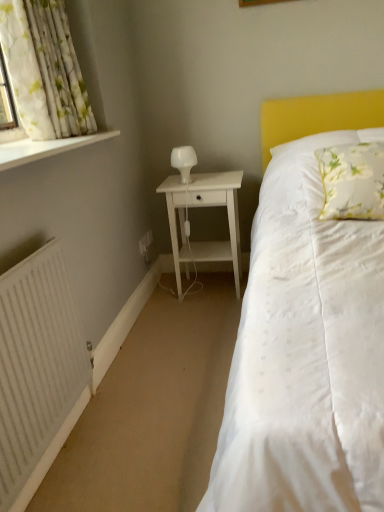
The height and width of the screenshot is (512, 384). What do you see at coordinates (352, 181) in the screenshot?
I see `floral fabric pillow at upper right` at bounding box center [352, 181].

The height and width of the screenshot is (512, 384). Describe the element at coordinates (37, 370) in the screenshot. I see `white matte radiator at lower left` at that location.

Based on the photo, measure the distance between white matte radiator at lower left and camera.

The distance of white matte radiator at lower left from camera is 1.14 meters.

What do you see at coordinates (200, 207) in the screenshot? I see `white wood nightstand at center` at bounding box center [200, 207].

Identify the location of white floral fabric curtain at upper left. (44, 69).

In the scene shown: What is the approximate height of white floral fabric curtain at upper left?

white floral fabric curtain at upper left is 24.23 inches tall.

Where is `white glossy table lamp at center`? white glossy table lamp at center is located at coordinates (184, 161).

How different are the orientations of white floral fabric curtain at upper left and white wood nightstand at center in degrees?

They differ by 87.9 degrees in their facing directions.

Based on their positions, is white floral fabric curtain at upper left located to the left or right of white wood nightstand at center?

From the image, it's evident that white floral fabric curtain at upper left is to the left of white wood nightstand at center.

Are white floral fabric curtain at upper left and white wood nightstand at center located far from each other?

That's not correct — white floral fabric curtain at upper left is a little close to white wood nightstand at center.

Can white wood nightstand at center be found inside white floral fabric curtain at upper left?

No, white wood nightstand at center is not surrounded by white floral fabric curtain at upper left.

Is point (235, 195) closer or farther from the camera than point (64, 143)?

Point (235, 195) is farther from the camera than point (64, 143).

Does white wood nightstand at center have a greater height compared to white painted wood at left?

Indeed, white wood nightstand at center has a greater height compared to white painted wood at left.

From the image's perspective, is white wood nightstand at center above or below white painted wood at left?

Based on their image positions, white wood nightstand at center is located beneath white painted wood at left.

Considering the positions of objects white matte radiator at lower left and white glossy table lamp at center in the image provided, who is more to the right, white matte radiator at lower left or white glossy table lamp at center?

white glossy table lamp at center.

Between point (72, 393) and point (182, 158), which one is positioned in front?

The point (72, 393) is closer.

Do you think white floral fabric curtain at upper left is within floral fabric pillow at upper right, or outside of it?

white floral fabric curtain at upper left lies outside floral fabric pillow at upper right.

Looking at this image, which of these two, white floral fabric curtain at upper left or floral fabric pillow at upper right, is thinner?

With smaller width is white floral fabric curtain at upper left.

Locate an element on the screen. curtain on the left of floral fabric pillow at upper right is located at coordinates (44, 69).

Is white glossy table lamp at center situated inside white painted wood at left or outside?

white glossy table lamp at center is located beyond the bounds of white painted wood at left.

From a real-world perspective, which object rests below the other?

white glossy table lamp at center.

Considering the sizes of objects white glossy table lamp at center and white painted wood at left in the image provided, who is thinner, white glossy table lamp at center or white painted wood at left?

With smaller width is white glossy table lamp at center.

Which of these two, white glossy table lamp at center or white painted wood at left, is bigger?

white painted wood at left.

The width and height of the screenshot is (384, 512). Find the location of `radiator on the left of the floral fabric pillow at upper right`. radiator on the left of the floral fabric pillow at upper right is located at coordinates (37, 370).

Is floral fabric pillow at upper right closer to the viewer compared to white matte radiator at lower left?

No, the depth of floral fabric pillow at upper right is greater than that of white matte radiator at lower left.

Can you tell me how much floral fabric pillow at upper right and white matte radiator at lower left differ in facing direction?

The facing directions of floral fabric pillow at upper right and white matte radiator at lower left are 93.7 degrees apart.

Looking at this image, from a real-world perspective, who is located lower, white wood nightstand at center or white floral fabric curtain at upper left?

white wood nightstand at center.

Based on the photo, in terms of height, does white wood nightstand at center look taller or shorter compared to white floral fabric curtain at upper left?

Clearly, white wood nightstand at center is taller compared to white floral fabric curtain at upper left.

Where is `curtain in front of the white wood nightstand at center`? This screenshot has height=512, width=384. curtain in front of the white wood nightstand at center is located at coordinates (44, 69).

This screenshot has height=512, width=384. Identify the location of curtain above the white wood nightstand at center (from the image's perspective). (44, 69).

The height and width of the screenshot is (512, 384). I want to click on window sill that appears in front of the white wood nightstand at center, so click(x=45, y=148).

Considering their positions, is floral fabric pillow at upper right positioned further to white floral fabric curtain at upper left than white wood nightstand at center?

floral fabric pillow at upper right.

Considering their positions, is white matte radiator at lower left positioned further to white wood nightstand at center than white floral fabric curtain at upper left?

The object further to white wood nightstand at center is white matte radiator at lower left.

When comparing their distances from white matte radiator at lower left, does white painted wood at left or white wood nightstand at center seem closer?

The object closer to white matte radiator at lower left is white painted wood at left.

From the image, which object appears to be farther from white glossy table lamp at center, white floral fabric curtain at upper left or floral fabric pillow at upper right?

The object further to white glossy table lamp at center is floral fabric pillow at upper right.

From the image, which object appears to be farther from white painted wood at left, floral fabric pillow at upper right or white matte radiator at lower left?

The object further to white painted wood at left is floral fabric pillow at upper right.

Based on their spatial positions, is white glossy table lamp at center or white wood nightstand at center further from white matte radiator at lower left?

white glossy table lamp at center.

When comparing their distances from white painted wood at left, does white glossy table lamp at center or floral fabric pillow at upper right seem further?

Based on the image, floral fabric pillow at upper right appears to be further to white painted wood at left.

In the scene shown: Based on their spatial positions, is white matte radiator at lower left or floral fabric pillow at upper right closer to white glossy table lamp at center?

floral fabric pillow at upper right is positioned closer to the anchor white glossy table lamp at center.

You are a GUI agent. You are given a task and a screenshot of the screen. Output one action in this format:
    pyautogui.click(x=<x>, y=<y>)
    Task: Click on the curtain between white painted wood at left and white glossy table lamp at center in the front-back direction
    
    Given the screenshot: What is the action you would take?
    pyautogui.click(x=44, y=69)

In order to click on nightstand located between white glossy table lamp at center and floral fabric pillow at upper right in the left-right direction in this screenshot , I will do `click(200, 207)`.

Where is `table lamp between white painted wood at left and floral fabric pillow at upper right`? Image resolution: width=384 pixels, height=512 pixels. table lamp between white painted wood at left and floral fabric pillow at upper right is located at coordinates (184, 161).

Locate an element on the screen. This screenshot has height=512, width=384. nightstand situated between white floral fabric curtain at upper left and floral fabric pillow at upper right from left to right is located at coordinates [200, 207].